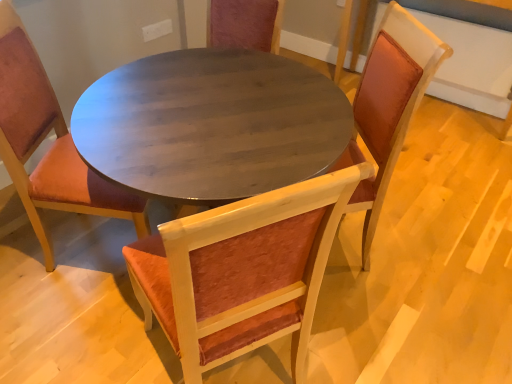
I want to click on vacant space to the right of velvet orange chair at center, which is the second chair from left to right, so click(x=357, y=334).